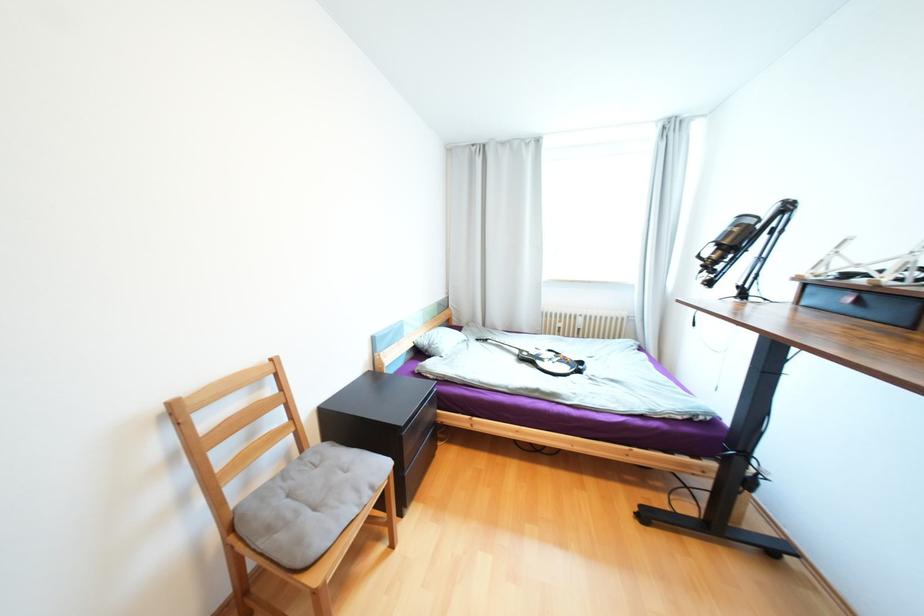
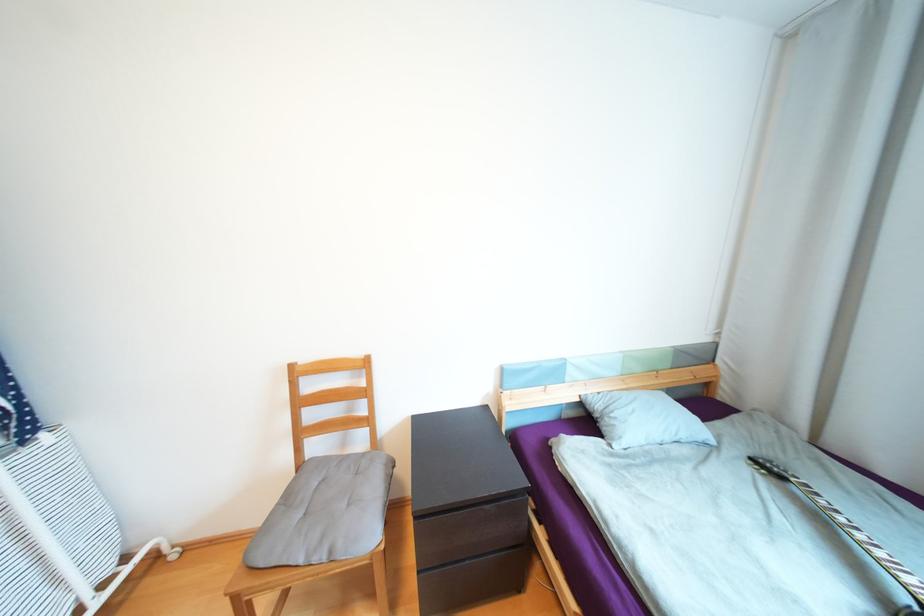
Find the pixel in the second image that matches [492,341] in the first image.

(787, 477)